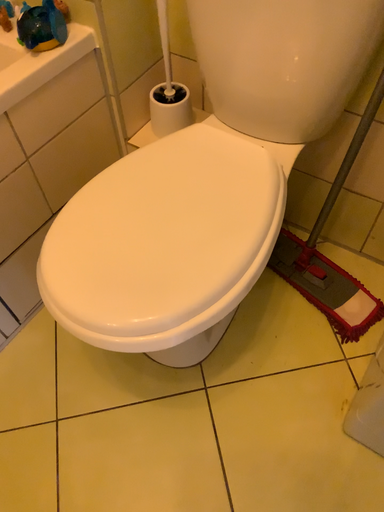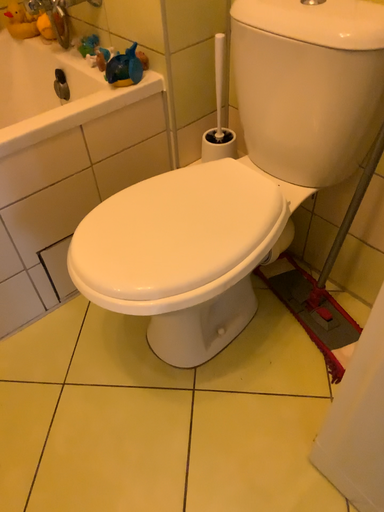
Question: How did the camera likely rotate when shooting the video?

Choices:
 (A) rotated upward
 (B) rotated downward

Answer: (A)